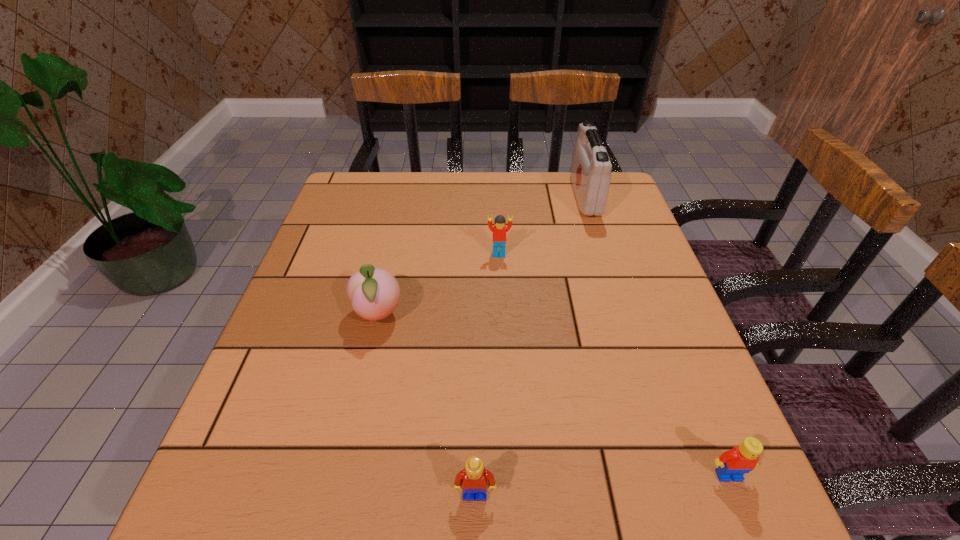
I want to click on vacant space at the near edge of the desktop, so click(321, 479).

Where is `vacant space at the left edge`? vacant space at the left edge is located at coordinates (364, 223).

This screenshot has height=540, width=960. Find the location of `vacant area at the right edge of the desktop`. vacant area at the right edge of the desktop is located at coordinates (590, 242).

In the image, there is a desktop. At what (x,y) coordinates should I click in order to perform the action: click on free region at the far left corner. Please return your answer as a coordinate pair (x, y). Image resolution: width=960 pixels, height=540 pixels. Looking at the image, I should click on (361, 212).

In the image, there is a desktop. Where is `vacant area at the far right corner`? vacant area at the far right corner is located at coordinates (629, 198).

I want to click on vacant space that's between the farthest Lego and the leftmost object, so click(x=439, y=285).

At what (x,y) coordinates should I click in order to perform the action: click on free space between the nearest object and the farthest Lego. Please return your answer as a coordinate pair (x, y). This screenshot has width=960, height=540. Looking at the image, I should click on (487, 374).

Locate an element on the screen. The image size is (960, 540). free space between the fourth nearest object and the second nearest object is located at coordinates (613, 364).

You are a GUI agent. You are given a task and a screenshot of the screen. Output one action in this format:
    pyautogui.click(x=<x>, y=<y>)
    Task: Click on the blank region between the farthest Lego and the rightmost Lego
    This screenshot has width=960, height=540.
    Given the screenshot: What is the action you would take?
    pyautogui.click(x=613, y=364)

Identify the location of blank region between the nearest Lego and the first-aid kit. The image size is (960, 540). click(x=530, y=345).